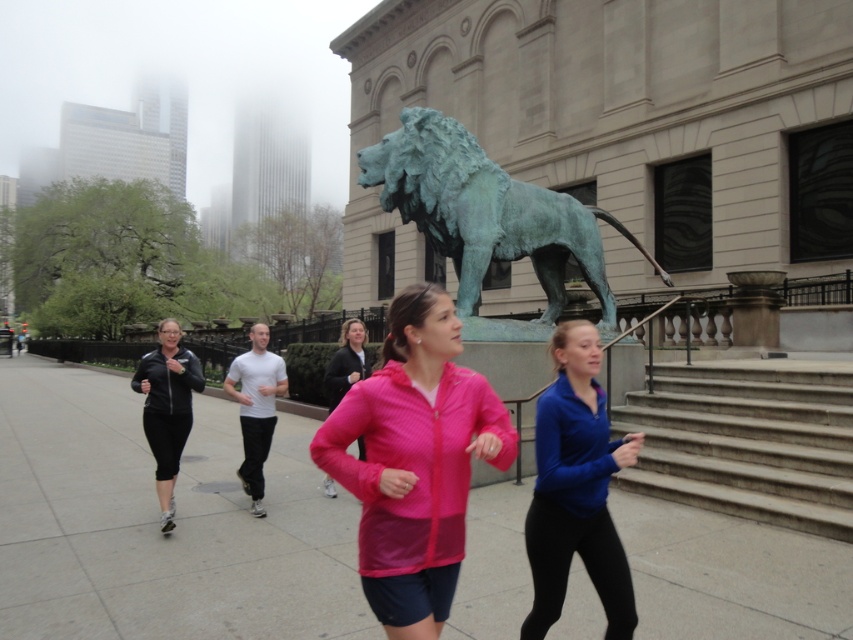
Question: Which point is closer to the camera taking this photo?

Choices:
 (A) (363, 372)
 (B) (496, 401)

Answer: (B)

Question: Which of the following is the farthest from the observer?

Choices:
 (A) (238, 378)
 (B) (339, 358)
 (C) (476, 208)
 (D) (444, 410)

Answer: (C)

Question: Is pink mesh jacket at center thinner than pink zip-up jacket at center?

Choices:
 (A) yes
 (B) no

Answer: (A)

Question: Does blue matte jacket at center have a greater width compared to pink zip-up jacket at center?

Choices:
 (A) no
 (B) yes

Answer: (A)

Question: Can you confirm if green patina lion at center is positioned below white matte t-shirt at center?

Choices:
 (A) yes
 (B) no

Answer: (B)

Question: Which point appears farthest from the camera in this image?

Choices:
 (A) (584, 326)
 (B) (241, 410)
 (C) (341, 368)
 (D) (161, 323)

Answer: (C)